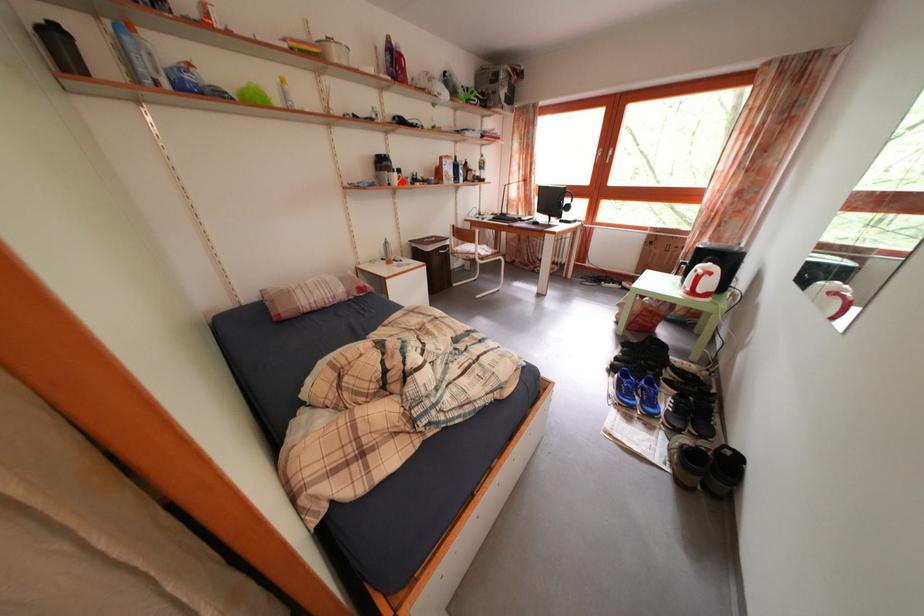
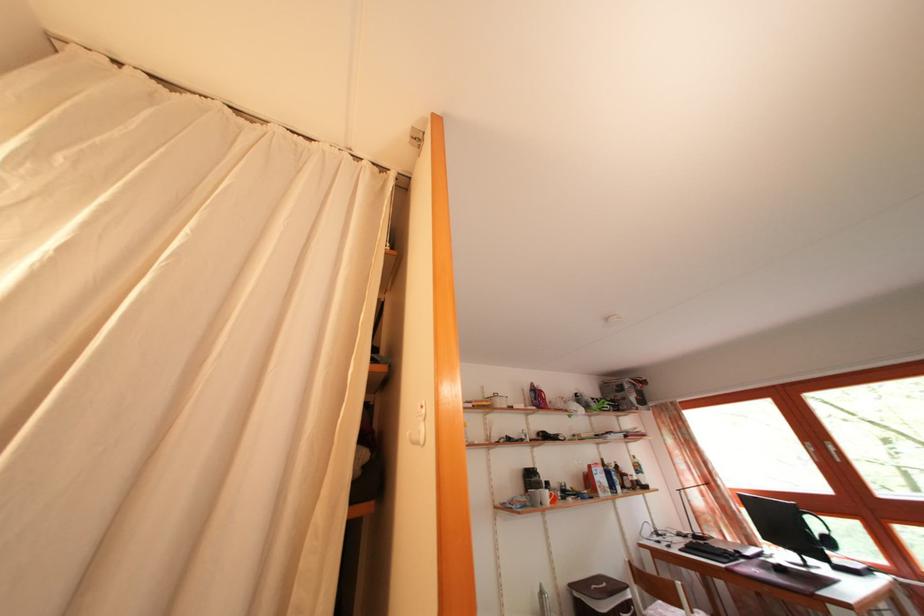
Question: I am providing you with two images of the same scene from different viewpoints. Image1 has a red point marked. In image2, the corresponding 3D location appears at what relative position? Reply with the corresponding letter.

Choices:
 (A) Closer
 (B) Farther

Answer: (B)